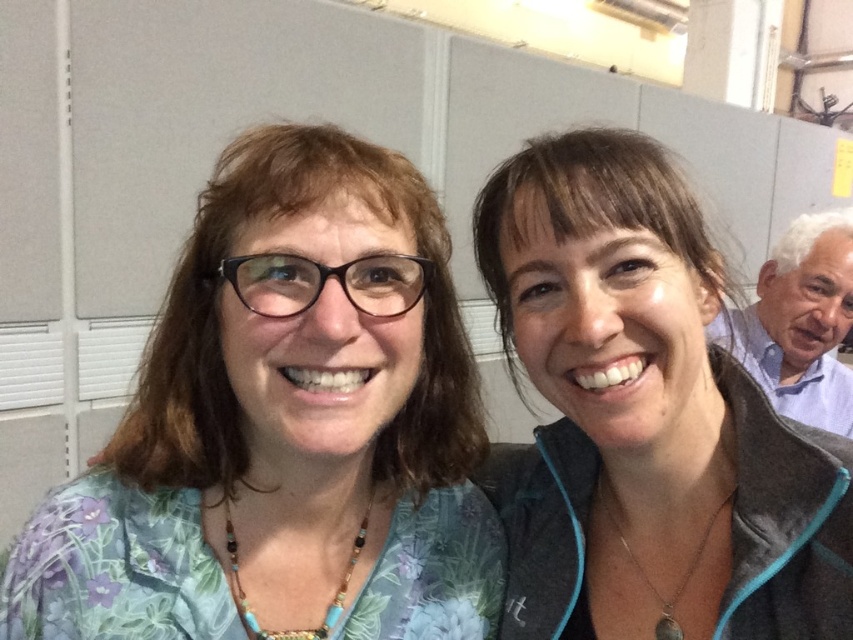
You are a photographer standing in front of the two people. You need to take a photo of the floral fabric shirt at left without the camera being visible in the shot. Can you position yourself in such a way that the camera is not in the frame while still capturing the shirt?

The floral fabric shirt at left and camera are 21.53 inches apart from each other. Since the camera is positioned close to the shirt, you can move slightly to the side or adjust your angle so that the camera doesn

You are standing in an office and need to determine the spatial relationship between the gray fleece jacket at upper right and the blue shirt at right. Based on the scene, which one is positioned lower?

The gray fleece jacket at upper right is located below the blue shirt at right, so the gray fleece jacket at upper right is positioned lower than the blue shirt at right.